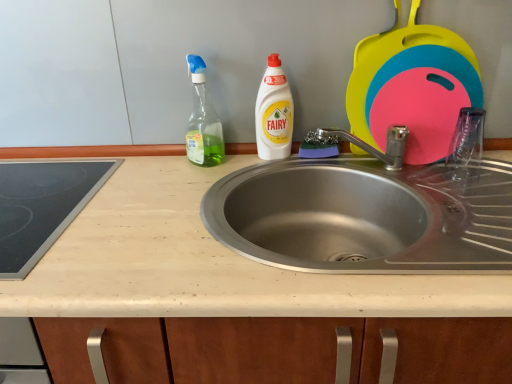
Locate an element on the screen. Image resolution: width=512 pixels, height=384 pixels. vacant area that is in front of green glass spray bottle at upper left, placed as the 1th cleaning product when sorted from left to right is located at coordinates (188, 185).